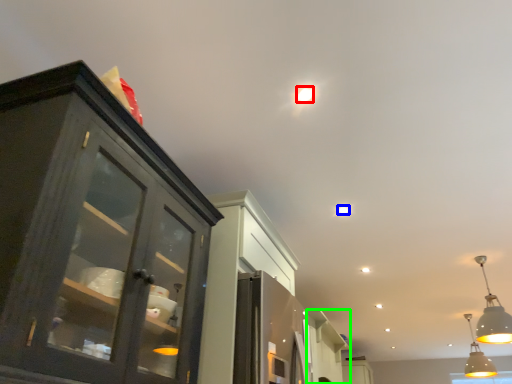
Question: Considering the real-world distances, which object is farthest from droplight (highlighted by a red box)? light (highlighted by a blue box) or cabinetry (highlighted by a green box)?

Choices:
 (A) light
 (B) cabinetry

Answer: (B)